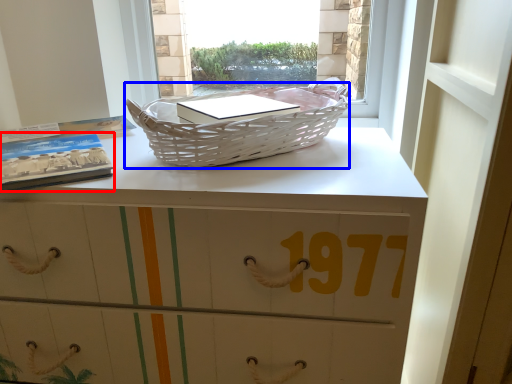
Question: Which of the following is the closest to the observer, paperback book (highlighted by a red box) or picnic basket (highlighted by a blue box)?

Choices:
 (A) paperback book
 (B) picnic basket

Answer: (B)